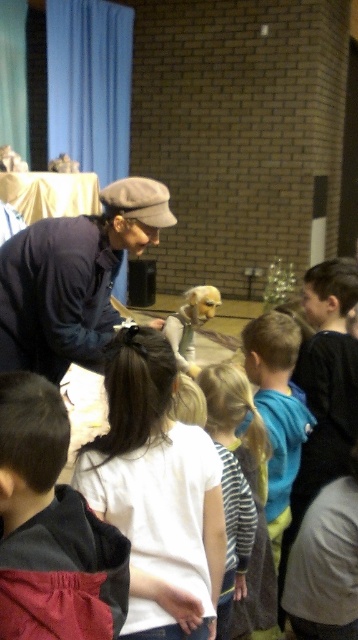
Can you confirm if white cotton shirt at center is bigger than matte blue shirt at center?

No.

Consider the image. Is white cotton shirt at center thinner than matte blue shirt at center?

Correct, white cotton shirt at center's width is less than matte blue shirt at center's.

Is point (92, 600) closer to camera compared to point (70, 237)?

Yes, it is.

Identify the location of white cotton shirt at center. click(x=50, y=529).

Does white cotton shirt at center have a lesser width compared to silvery metallic dog at center?

Yes, white cotton shirt at center is thinner than silvery metallic dog at center.

Does white cotton shirt at center appear under silvery metallic dog at center?

Yes.

This screenshot has height=640, width=358. Describe the element at coordinates (50, 529) in the screenshot. I see `white cotton shirt at center` at that location.

Locate an element on the screen. white cotton shirt at center is located at coordinates (50, 529).

Which of these two, white cotton shirt at center or striped shirt at center, stands taller?

With more height is striped shirt at center.

Does white cotton shirt at center appear on the left side of striped shirt at center?

Correct, you'll find white cotton shirt at center to the left of striped shirt at center.

Between point (2, 518) and point (260, 588), which one is positioned in front?

Positioned in front is point (2, 518).

The width and height of the screenshot is (358, 640). What are the coordinates of `white cotton shirt at center` in the screenshot? It's located at (50, 529).